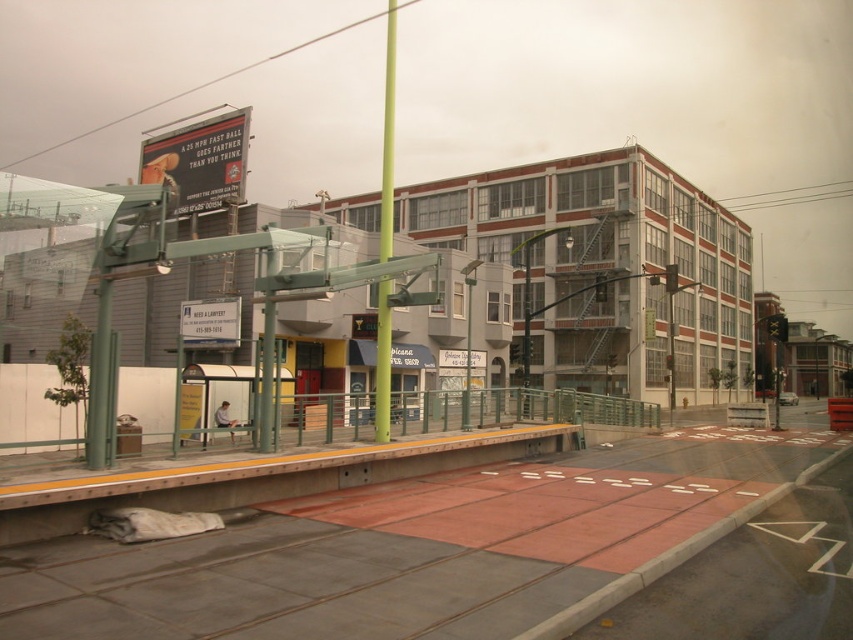
Question: Does red rubber train track at lower center have a lesser width compared to green matte pole at center?

Choices:
 (A) yes
 (B) no

Answer: (A)

Question: Does red rubber train track at lower center have a larger size compared to green matte pole at center?

Choices:
 (A) no
 (B) yes

Answer: (A)

Question: Which point appears farthest from the camera in this image?

Choices:
 (A) (386, 403)
 (B) (723, 460)

Answer: (B)

Question: Can you confirm if red rubber train track at lower center is positioned above green matte pole at center?

Choices:
 (A) no
 (B) yes

Answer: (A)

Question: Which object is closer to the camera taking this photo?

Choices:
 (A) red rubber train track at lower center
 (B) green matte pole at center

Answer: (A)